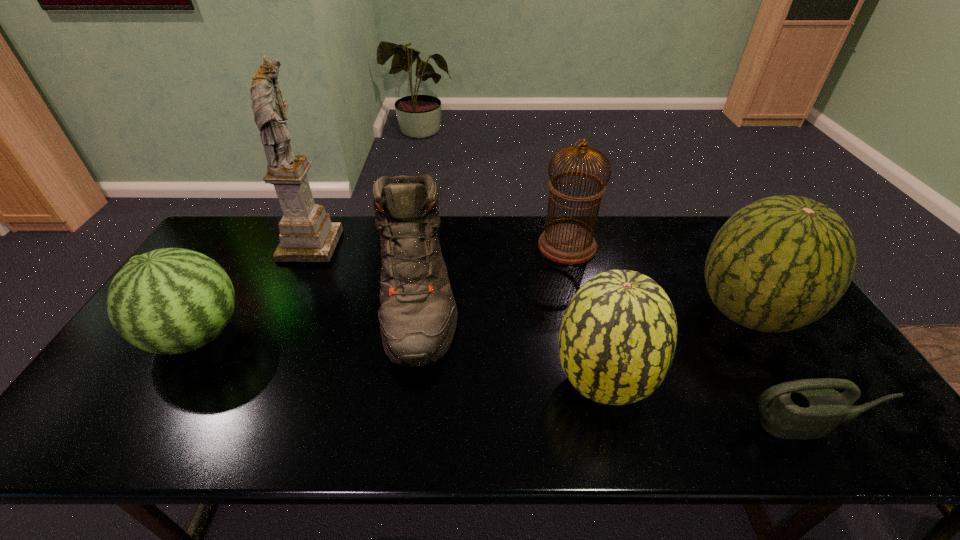
I want to click on object at the left edge, so click(172, 300).

Where is `watermelon that is at the right edge`? watermelon that is at the right edge is located at coordinates (782, 262).

The image size is (960, 540). In order to click on watering can that is at the right edge in this screenshot , I will do `click(809, 408)`.

Find the location of a particular element. The image size is (960, 540). object at the near right corner is located at coordinates (809, 408).

At what (x,y) coordinates should I click in order to perform the action: click on vacant area at the far edge. Please return your answer as a coordinate pair (x, y). Looking at the image, I should click on (627, 239).

This screenshot has height=540, width=960. Find the location of `blank space at the near edge`. blank space at the near edge is located at coordinates (529, 430).

This screenshot has height=540, width=960. In order to click on free space at the left edge in this screenshot , I will do `click(137, 366)`.

The width and height of the screenshot is (960, 540). Find the location of `vacant space at the far left corner`. vacant space at the far left corner is located at coordinates (231, 228).

You are a GUI agent. You are given a task and a screenshot of the screen. Output one action in this format:
    pyautogui.click(x=<x>, y=<y>)
    Task: Click on the vacant space that is in between the birdcage and the fifth object from right to left
    The height and width of the screenshot is (540, 960).
    Given the screenshot: What is the action you would take?
    pyautogui.click(x=492, y=271)

Find the location of `free space between the tallest object and the shortest object`. free space between the tallest object and the shortest object is located at coordinates (558, 336).